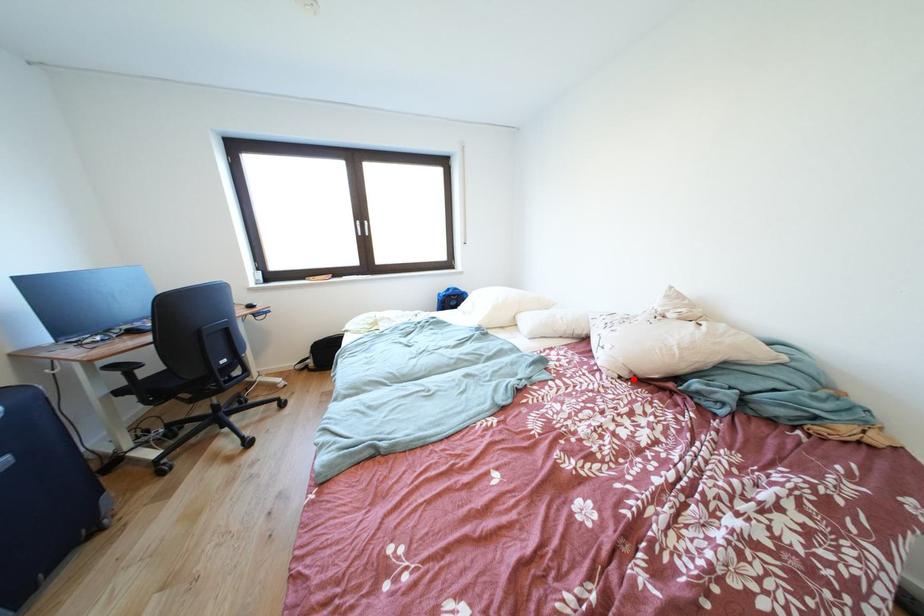
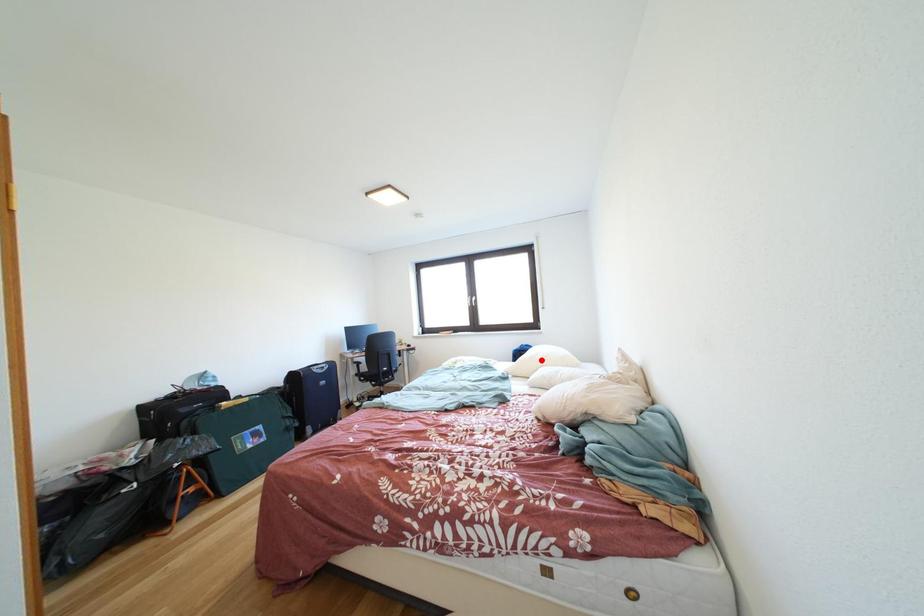
I am providing you with two images of the same scene from different viewpoints. A red point is marked on the first image and another point is marked on the second image. Is the marked point in image1 the same physical position as the marked point in image2?

No